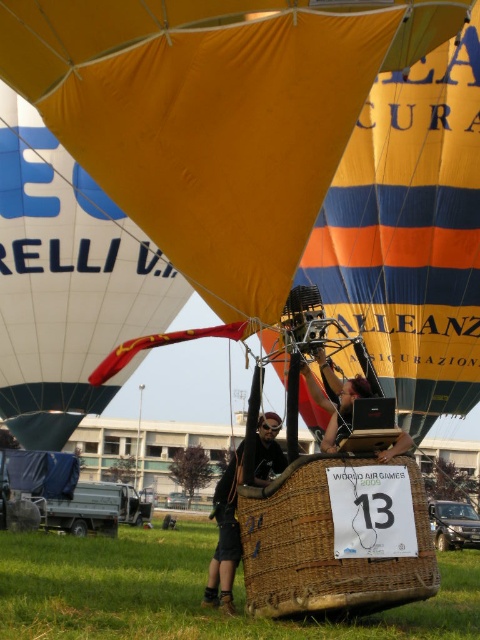
Question: Among these objects, which one is farthest from the camera?

Choices:
 (A) black matte laptop at center
 (B) yellow fabric hot air balloon at center

Answer: (A)

Question: Estimate the real-world distances between objects in this image. Which object is farther from the matte black laptop at center?

Choices:
 (A) black matte laptop at center
 (B) orange fabric balloon at center
 (C) yellow fabric balloon at upper left

Answer: (C)

Question: Which point appears farthest from the camera in this image?

Choices:
 (A) (383, 252)
 (B) (355, 381)
 (C) (264, 202)
 (D) (381, 449)

Answer: (A)

Question: Is orange fabric balloon at center above woven wicker basket at center?

Choices:
 (A) yes
 (B) no

Answer: (A)

Question: Can you confirm if matte black helmet at center is positioned to the left of black matte laptop at center?

Choices:
 (A) no
 (B) yes

Answer: (B)

Question: Is yellow fabric hot air balloon at center bigger than orange fabric balloon at center?

Choices:
 (A) no
 (B) yes

Answer: (B)